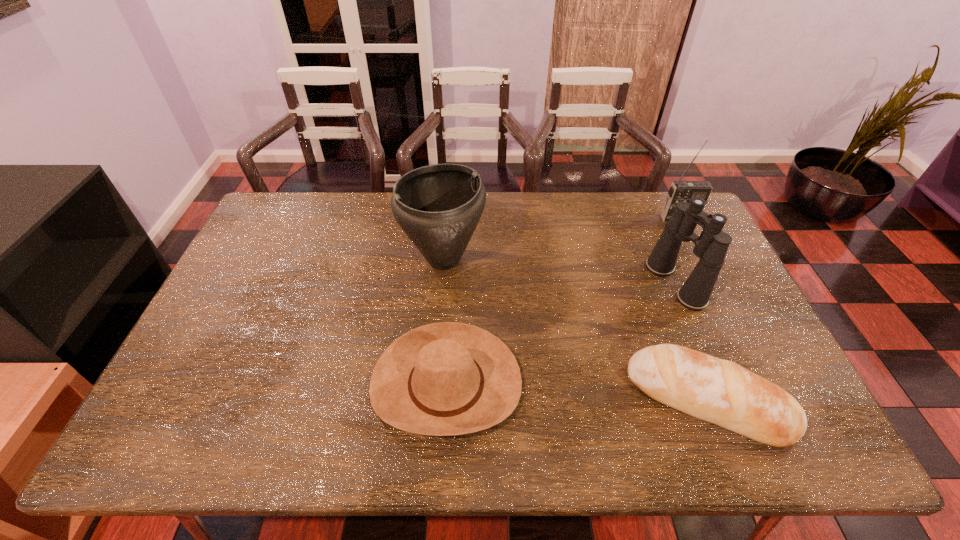
Find the location of a particular element. urn that is positioned at the far edge is located at coordinates (438, 206).

You are a GUI agent. You are given a task and a screenshot of the screen. Output one action in this format:
    pyautogui.click(x=<x>, y=<y>)
    Task: Click on the cowboy hat situated at the near edge
    This screenshot has height=540, width=960.
    Given the screenshot: What is the action you would take?
    pyautogui.click(x=442, y=379)

Identify the location of bread at the near edge. (718, 391).

Find the location of a particular element. radio receiver positioned at the right edge is located at coordinates click(680, 191).

Identify the location of binoculars present at the right edge. This screenshot has height=540, width=960. (711, 246).

The image size is (960, 540). I want to click on bread positioned at the right edge, so click(718, 391).

The height and width of the screenshot is (540, 960). Identify the location of object located in the far right corner section of the desktop. tap(680, 191).

In order to click on object present at the near right corner in this screenshot , I will do `click(718, 391)`.

This screenshot has height=540, width=960. I want to click on vacant area at the far edge of the desktop, so click(609, 202).

Find the location of a particular element. vacant space at the near edge of the desktop is located at coordinates (420, 445).